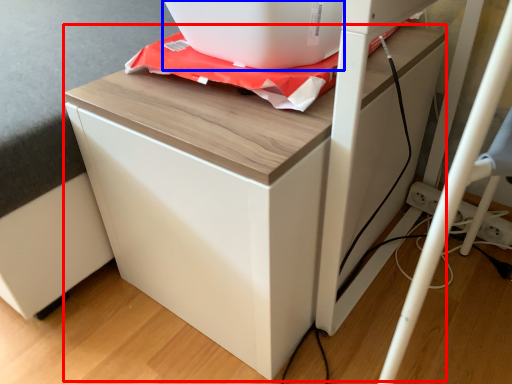
Question: Among these objects, which one is nearest to the camera, furniture (highlighted by a red box) or appliance (highlighted by a blue box)?

Choices:
 (A) furniture
 (B) appliance

Answer: (A)